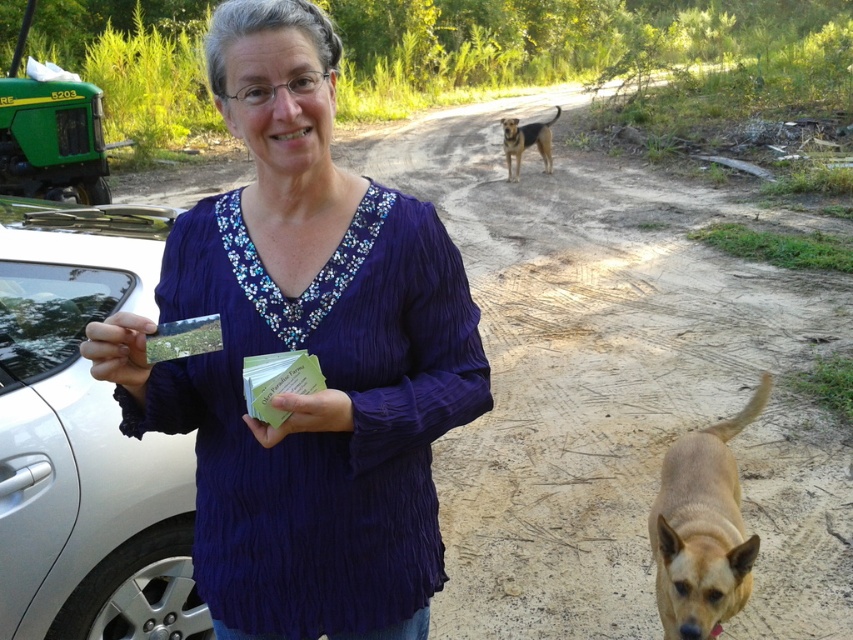
Question: Can you confirm if matte plastic card at lower left is wider than green paper at center?

Choices:
 (A) yes
 (B) no

Answer: (B)

Question: Can you confirm if silver metallic car at lower left is bigger than light brown fur at center?

Choices:
 (A) yes
 (B) no

Answer: (A)

Question: Which object is positioned farthest from the green paper money at center?

Choices:
 (A) purple crinkled shirt at center
 (B) green paper at center

Answer: (A)

Question: Does purple crinkled shirt at center have a larger size compared to green paper packet at center?

Choices:
 (A) no
 (B) yes

Answer: (B)

Question: Among these objects, which one is farthest from the camera?

Choices:
 (A) brown-furred dog at center
 (B) green paper at center
 (C) light brown fur at center

Answer: (A)

Question: Which point is closer to the camera taking this photo?

Choices:
 (A) (67, 336)
 (B) (740, 417)
 (C) (300, 432)
 (D) (253, 413)

Answer: (D)